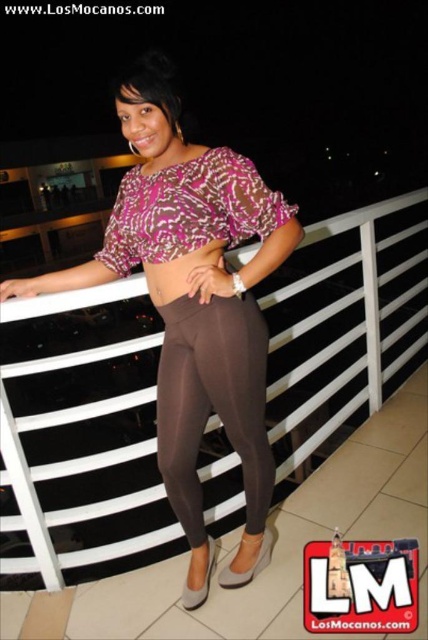
You are a photographer trying to capture the woman on the balcony. The point that represents the matte brown leggings at center is at coordinate point (193, 307). If you want to focus on the leggings, where should you aim your camera? Please provide the coordinates in the format of point followed by the numbers in parentheses.

The point representing the matte brown leggings at center is located at point (193, 307). Therefore, you should aim your camera at point (193, 307) to focus on the leggings.

You are standing on the balcony and want to place a small potted plant between the two points, point (198, 605) and point (178, 420). Will the plant be closer to the railing or the woman?

The point (198, 605) is closer to the viewer than point (178, 420). Since the railing is behind the woman, placing the plant between them would position it closer to the woman rather than the railing.

You are a fashion designer observing the woman on the balcony. You notice she is wearing two pairs of leggings at center. Which leggings are positioned lower on her body, the brown smooth leggings at center or the brown matte leggings at center?

The brown smooth leggings at center are located below the brown matte leggings at center, meaning they are positioned lower on her body.